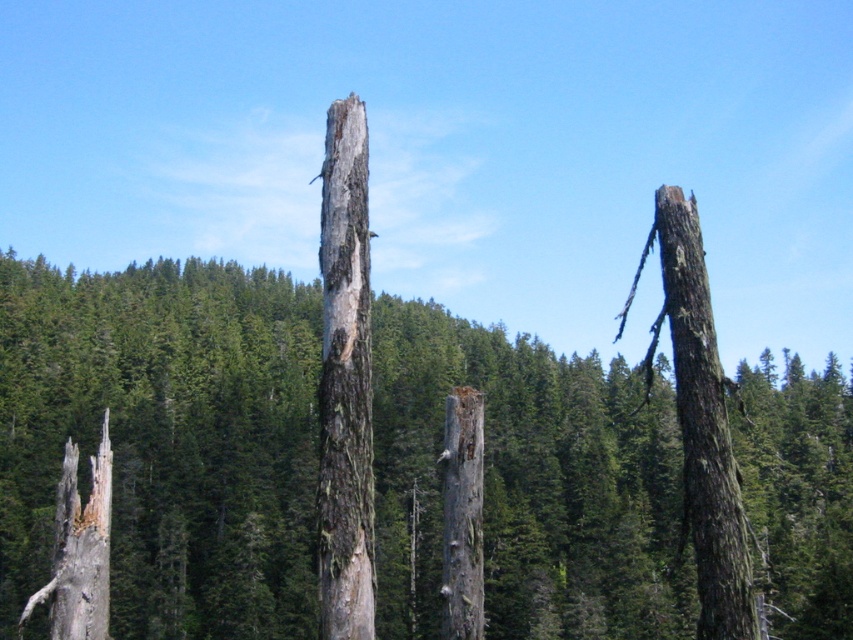
You are a hiker who wants to place a small backpack between the green rough bark at center and the gray rough bark tree trunk at center. Which object should you place the backpack closer to if you want it to be near the larger one?

The green rough bark at center is larger in size compared to the gray rough bark tree trunk at center, so you should place the backpack closer to the green rough bark at center to be near the larger one.